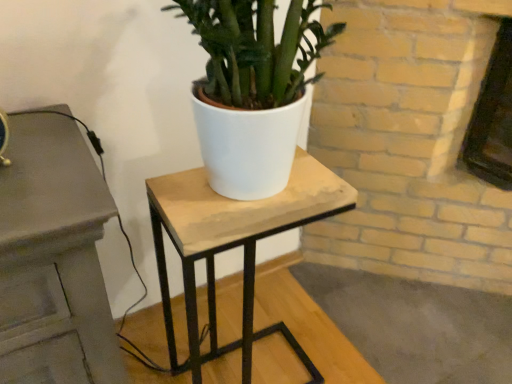
Where is `unoccupied region to the right of wooden table at center`? Image resolution: width=512 pixels, height=384 pixels. unoccupied region to the right of wooden table at center is located at coordinates (348, 341).